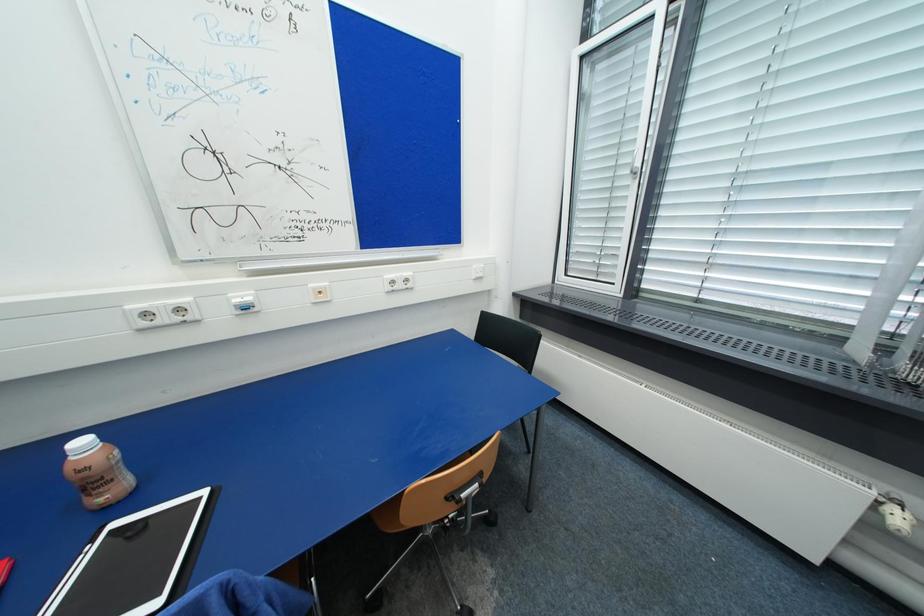
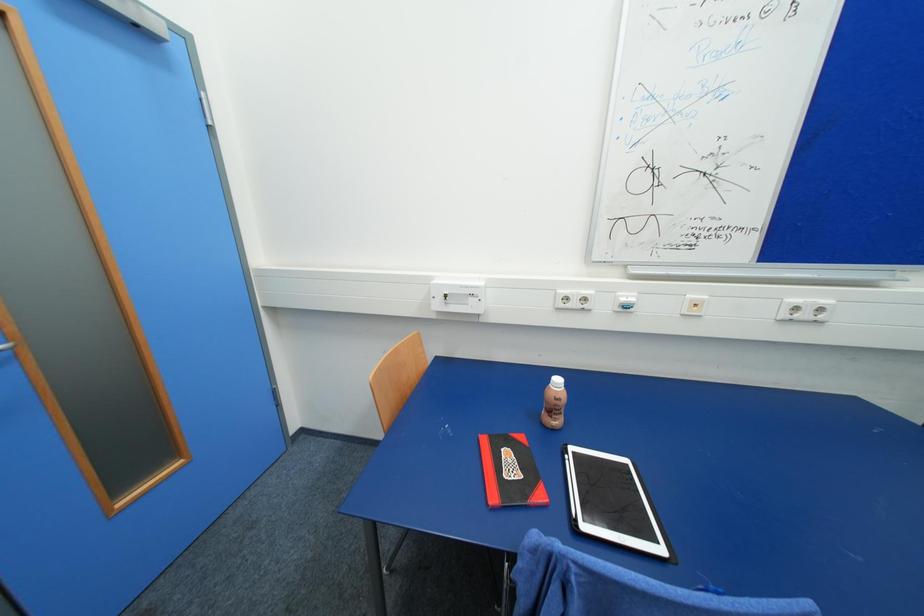
Question: How did the camera likely rotate?

Choices:
 (A) Left
 (B) Right
 (C) Up
 (D) Down

Answer: (A)